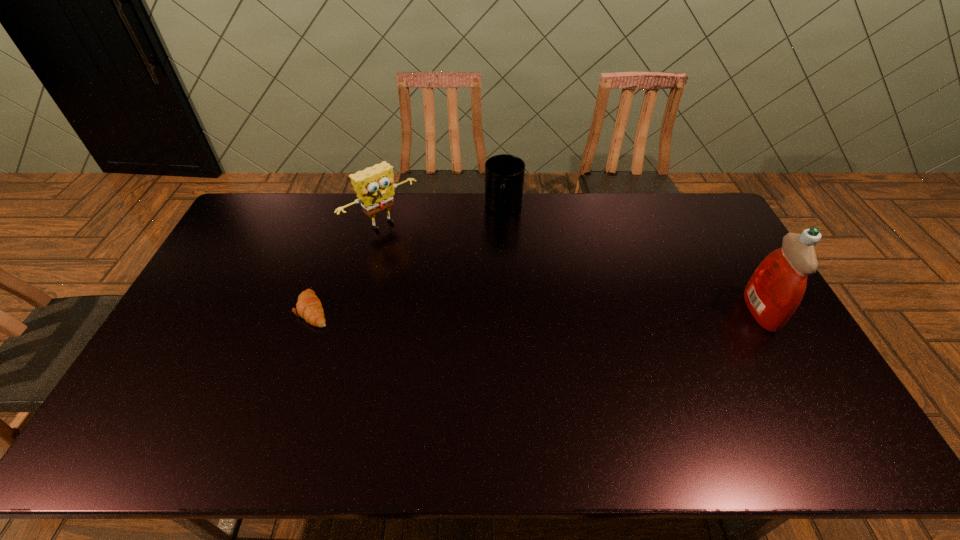
The height and width of the screenshot is (540, 960). In the image, there is a desktop. Find the location of `vacant space at the near left corner`. vacant space at the near left corner is located at coordinates [x=161, y=387].

Identify the location of vacant space at the far right corner of the desktop. This screenshot has height=540, width=960. (667, 195).

Identify the location of free space between the crescent roll and the detergent. Image resolution: width=960 pixels, height=540 pixels. (537, 310).

The height and width of the screenshot is (540, 960). Find the location of `vacant area that lies between the third object from left to right and the second tallest object`. vacant area that lies between the third object from left to right and the second tallest object is located at coordinates (444, 216).

Where is `free spot between the third shortest object and the detergent`? free spot between the third shortest object and the detergent is located at coordinates (571, 267).

The height and width of the screenshot is (540, 960). I want to click on empty location between the tallest object and the third tallest object, so click(x=632, y=259).

Identify the location of vacant area that lies between the detergent and the sponge. Image resolution: width=960 pixels, height=540 pixels. (571, 267).

What are the coordinates of `unoccupied position between the third object from left to right and the third shortest object` in the screenshot? It's located at (444, 216).

At what (x,y) coordinates should I click in order to perform the action: click on empty space that is in between the rightmost object and the shortest object. Please return your answer as a coordinate pair (x, y). Looking at the image, I should click on (537, 310).

The image size is (960, 540). Identify the location of free space between the second object from right to left and the detergent. (632, 259).